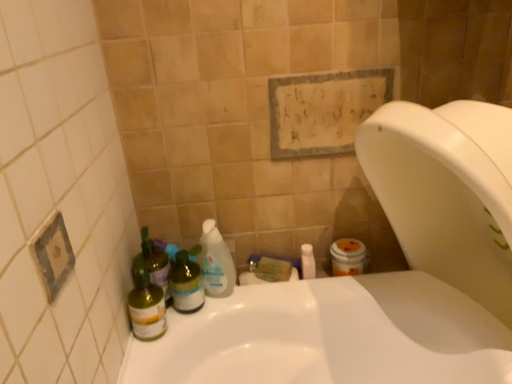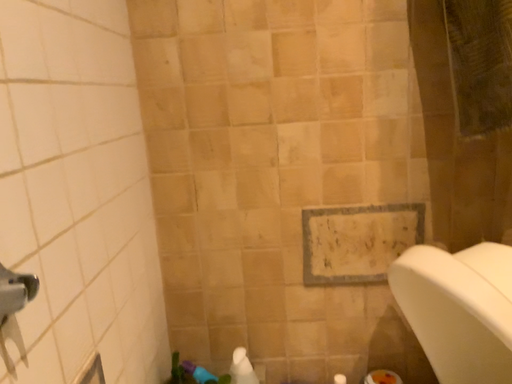
Question: How did the camera likely rotate when shooting the video?

Choices:
 (A) rotated downward
 (B) rotated upward

Answer: (B)